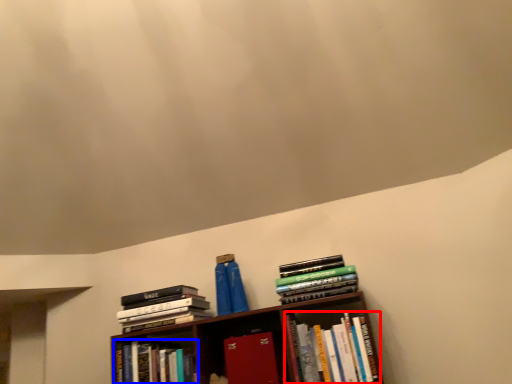
Question: Among these objects, which one is farthest to the camera, book (highlighted by a red box) or book (highlighted by a blue box)?

Choices:
 (A) book
 (B) book

Answer: (B)